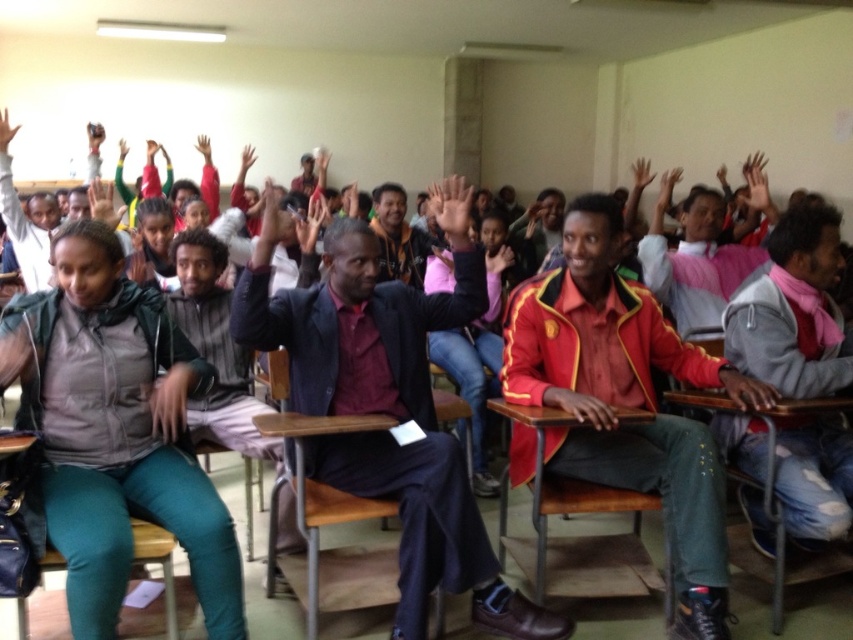
The width and height of the screenshot is (853, 640). Find the location of `maroon fabric shirt at center`. maroon fabric shirt at center is located at coordinates (389, 404).

Where is `maroon fabric shirt at center`? maroon fabric shirt at center is located at coordinates (389, 404).